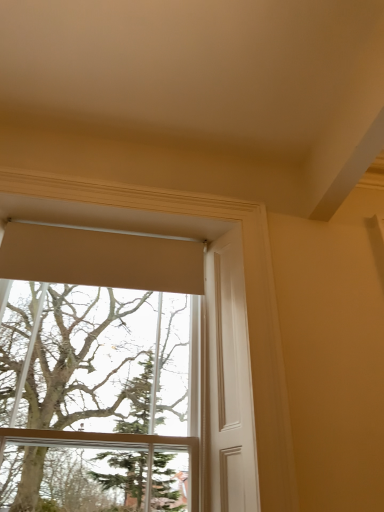
Describe the element at coordinates (147, 203) in the screenshot. I see `matte beige roller blind at upper center` at that location.

Find the location of `matte beige roller blind at upper center`. matte beige roller blind at upper center is located at coordinates (147, 203).

Where is `matte beige roller blind at upper center`? The image size is (384, 512). matte beige roller blind at upper center is located at coordinates [x=147, y=203].